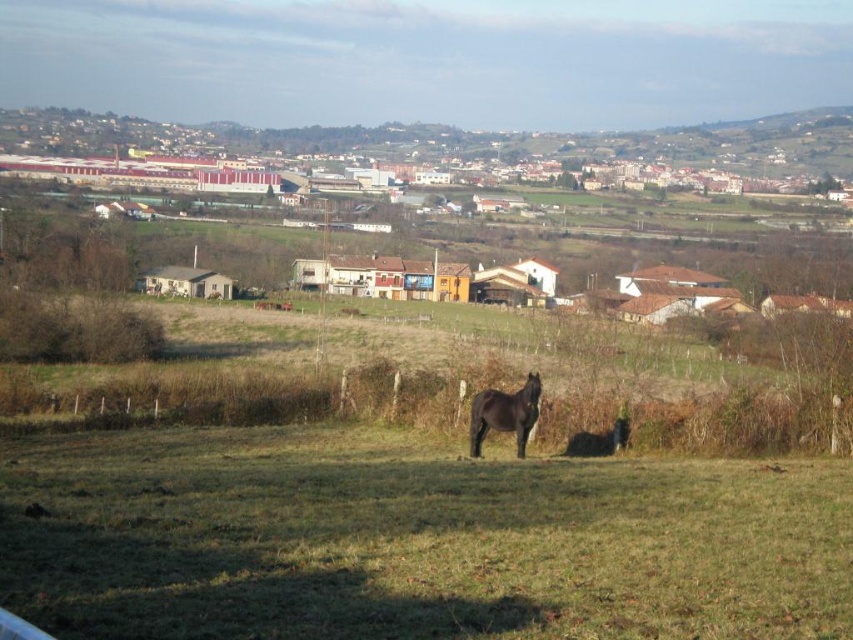
You are standing in the middle of the green grassy field at center and want to walk towards the black glossy horse at center. In which direction should you move relative to the field?

Since the green grassy field at center is positioned on the left side of the black glossy horse at center, you should move to the right to reach the horse from the field.